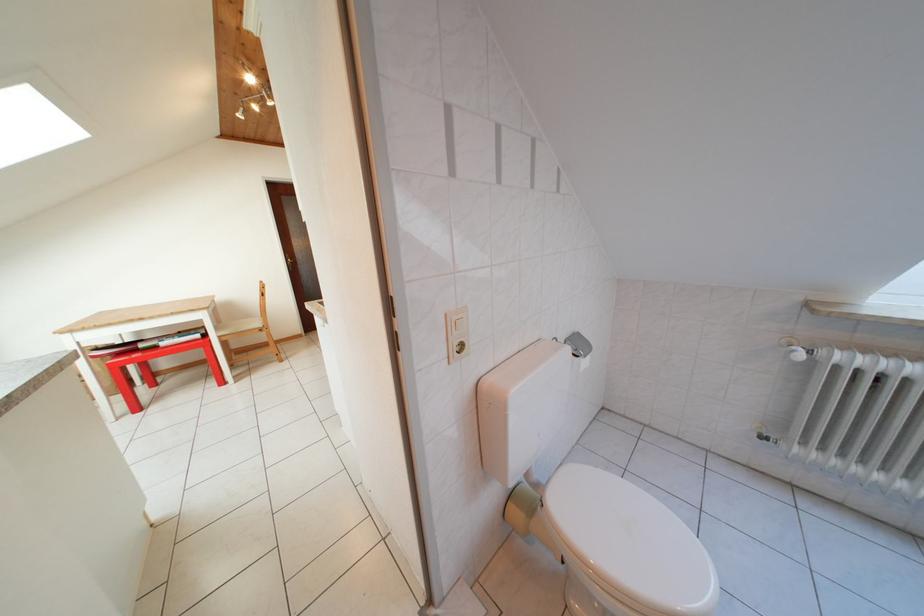
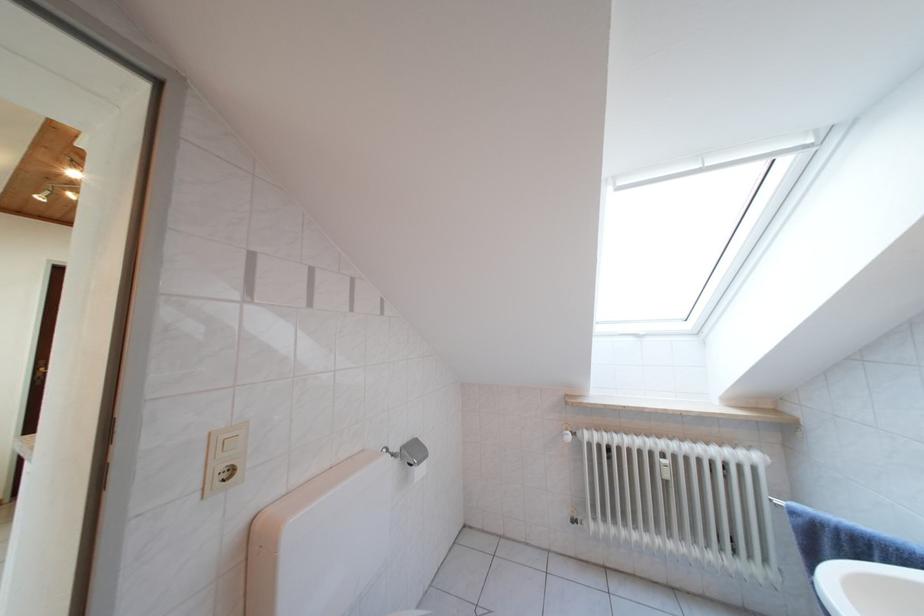
Find the pixel in the second image that matches the point at 830,358 in the first image.

(588, 439)